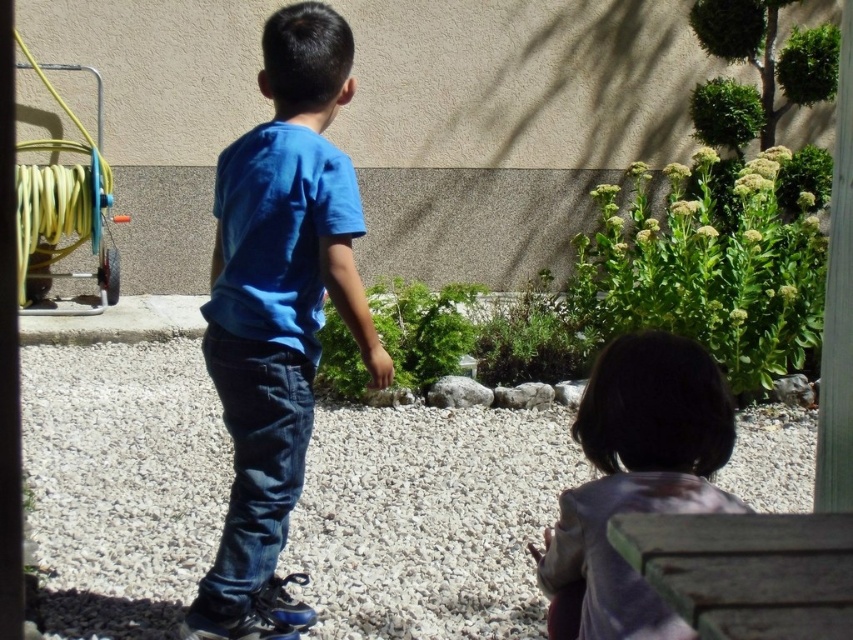
You are standing in the garden and want to place a small potted plant exactly at the center of the purple fabric at lower right. According to the image, what are the coordinates where you should place the potted plant?

The coordinates for the center of the purple fabric at lower right are approximately at point (635, 481).

You are standing in the garden and want to place a small potted plant exactly at the point marked by coordinates point (635, 481). Which object in the scene is located closest to this point?

The point (635, 481) corresponds to the purple fabric at lower right, so the closest object is the purple fabric at lower right.

You are a gardener who wants to place a new plant pot between the purple fabric at lower right and the smooth gray rock at center. Based on their heights, which object should the pot be placed closer to in order to avoid blocking sunlight to the shorter one?

The purple fabric at lower right is taller than the smooth gray rock at center. To avoid blocking sunlight to the shorter smooth gray rock at center, the new plant pot should be placed closer to the purple fabric at lower right.